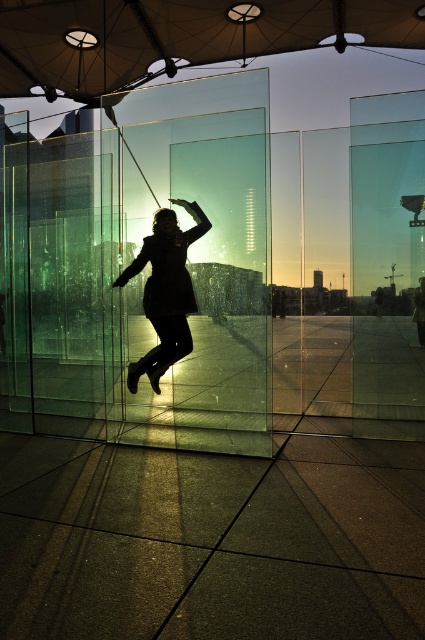
You are a photographer positioned in the modern architectural space. You need to capture a photo of both the transparent fabric umbrella at upper center and the black matte coat at center. Which object should you focus on first to ensure both are in sharp focus?

You should focus on the transparent fabric umbrella at upper center first because it is closer to you than the black matte coat at center. By focusing on the closer object, the farther object will also be in focus due to the depth of field.

You are an interior designer planning to hang a new decorative item in this space. You have two options from the objects present in the scene. Which object, the transparent fabric umbrella at upper center or the black matte coat at center, would be more suitable for hanging due to its size if you want to create a bold visual impact?

The transparent fabric umbrella at upper center has a larger size compared to the black matte coat at center, making it more suitable for creating a bold visual impact when hung as a decorative item.